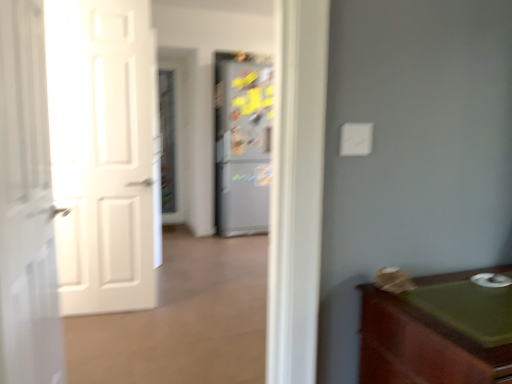
This screenshot has width=512, height=384. I want to click on vacant area that lies to the right of white matte door at left, the first door in the back-to-front sequence, so click(160, 309).